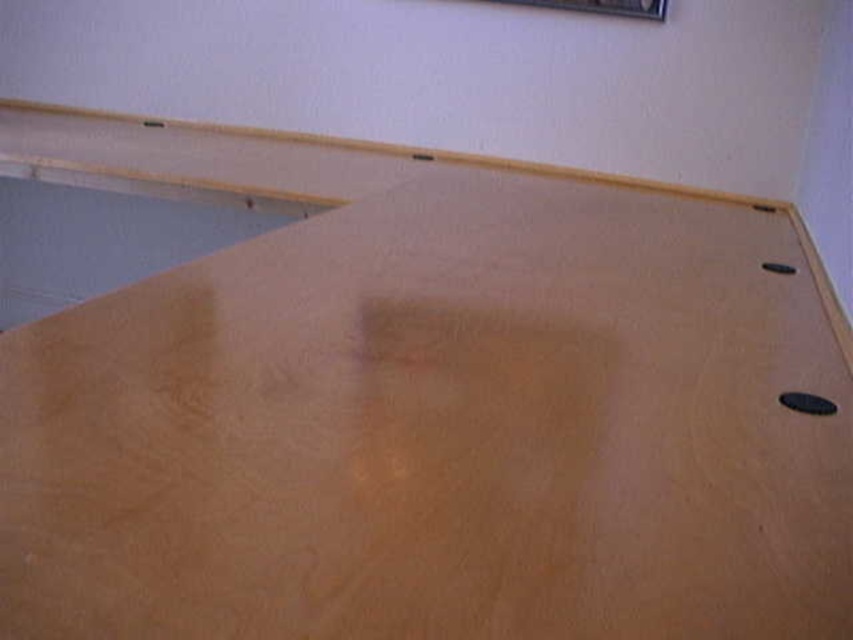
Question: Does light brown wood table at upper center have a larger size compared to metallic silver picture frame at upper center?

Choices:
 (A) no
 (B) yes

Answer: (B)

Question: Which point is farther to the camera?

Choices:
 (A) metallic silver picture frame at upper center
 (B) light brown wood table at upper center

Answer: (A)

Question: Can you confirm if light brown wood table at upper center is positioned above metallic silver picture frame at upper center?

Choices:
 (A) no
 (B) yes

Answer: (A)

Question: Does light brown wood table at upper center come in front of metallic silver picture frame at upper center?

Choices:
 (A) no
 (B) yes

Answer: (B)